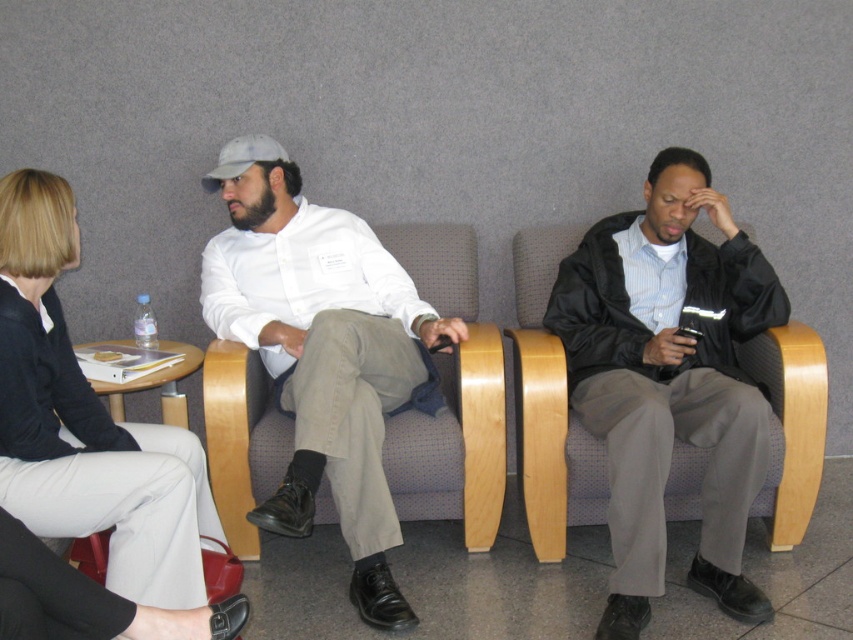
Is black matte jacket at center to the left of matte black blazer at center from the viewer's perspective?

No, black matte jacket at center is not to the left of matte black blazer at center.

Is black matte jacket at center to the right of matte black blazer at center from the viewer's perspective?

Correct, you'll find black matte jacket at center to the right of matte black blazer at center.

Between point (647, 321) and point (62, 211), which one is positioned in front?

Positioned in front is point (62, 211).

Locate an element on the screen. black matte jacket at center is located at coordinates (669, 380).

Based on the photo, does black matte jacket at center have a larger size compared to matte white shirt at center?

No.

What do you see at coordinates (669, 380) in the screenshot?
I see `black matte jacket at center` at bounding box center [669, 380].

Who is more forward, (640, 490) or (273, 364)?

Positioned in front is point (640, 490).

Image resolution: width=853 pixels, height=640 pixels. I want to click on black matte jacket at center, so click(669, 380).

Is point (287, 314) positioned after point (193, 532)?

Yes, it is behind point (193, 532).

Can you confirm if matte white shirt at center is wider than matte black blazer at center?

Yes.

Is point (426, 376) more distant than point (161, 458)?

Yes.

The height and width of the screenshot is (640, 853). In order to click on matte white shirt at center in this screenshot , I will do `click(322, 352)`.